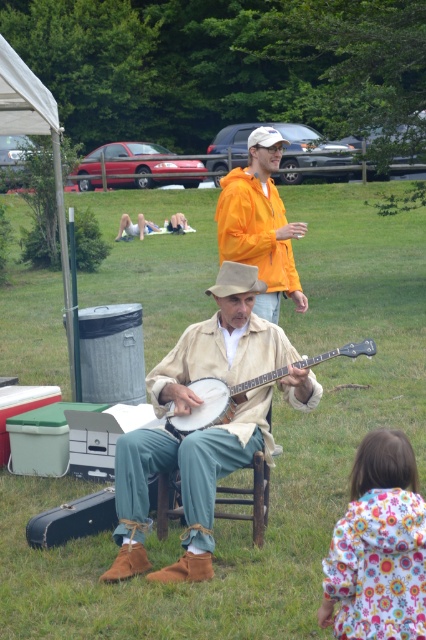
Question: Which object is positioned farthest from the beige felt cowboy hat at center?

Choices:
 (A) wooden banjo at center
 (B) leather banjo at center
 (C) green grass at center

Answer: (C)

Question: Which point is farther from the camera taking this photo?

Choices:
 (A) (377, 401)
 (B) (256, 272)
 (C) (359, 486)
 (D) (178, 422)

Answer: (A)

Question: Can you confirm if leather banjo at center is positioned to the right of wooden banjo at center?

Choices:
 (A) no
 (B) yes

Answer: (A)

Question: Which point appears farthest from the camera in this image?

Choices:
 (A) (340, 632)
 (B) (284, 524)
 (C) (247, 289)
 (D) (270, 257)

Answer: (D)

Question: Is leather banjo at center to the left of floral fabric coat at lower right from the viewer's perspective?

Choices:
 (A) no
 (B) yes

Answer: (B)

Question: Can you confirm if leather banjo at center is positioned above orange matte jacket at upper center?

Choices:
 (A) yes
 (B) no

Answer: (B)